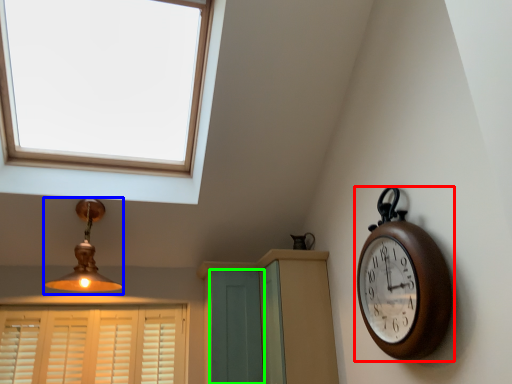
Question: Based on their relative distances, which object is farther from wall clock (highlighted by a red box)? Choose from lamp (highlighted by a blue box) and screen door (highlighted by a green box).

Choices:
 (A) lamp
 (B) screen door

Answer: (A)